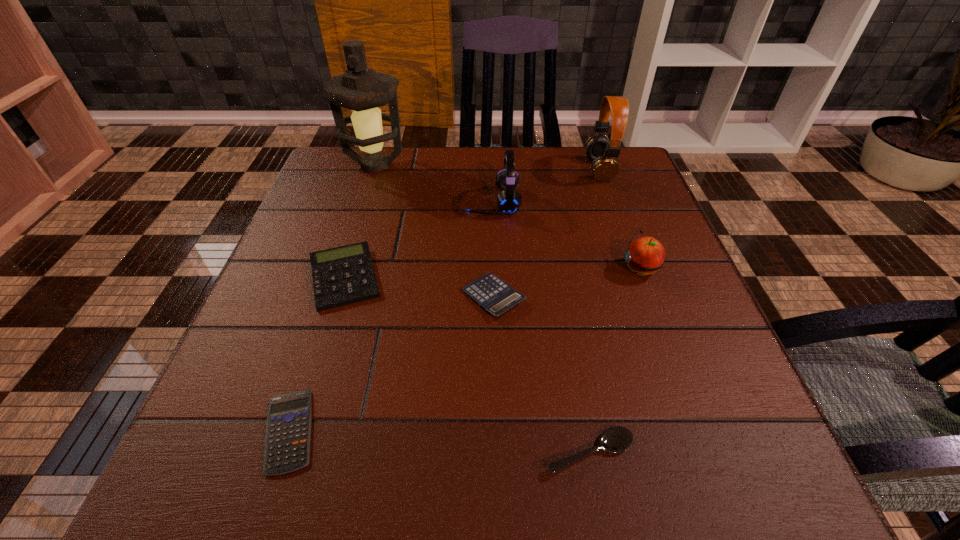
Identify the location of free location that satisfies the following two spatial constraints: 1. on the back side of the fourth tallest object; 2. on the ear cups of the right headset. This screenshot has width=960, height=540. (604, 170).

Where is `vacant point that satisfies the following two spatial constraints: 1. on the back side of the second tallest calculator; 2. on the left side of the fifth shortest object`? The height and width of the screenshot is (540, 960). vacant point that satisfies the following two spatial constraints: 1. on the back side of the second tallest calculator; 2. on the left side of the fifth shortest object is located at coordinates (492, 268).